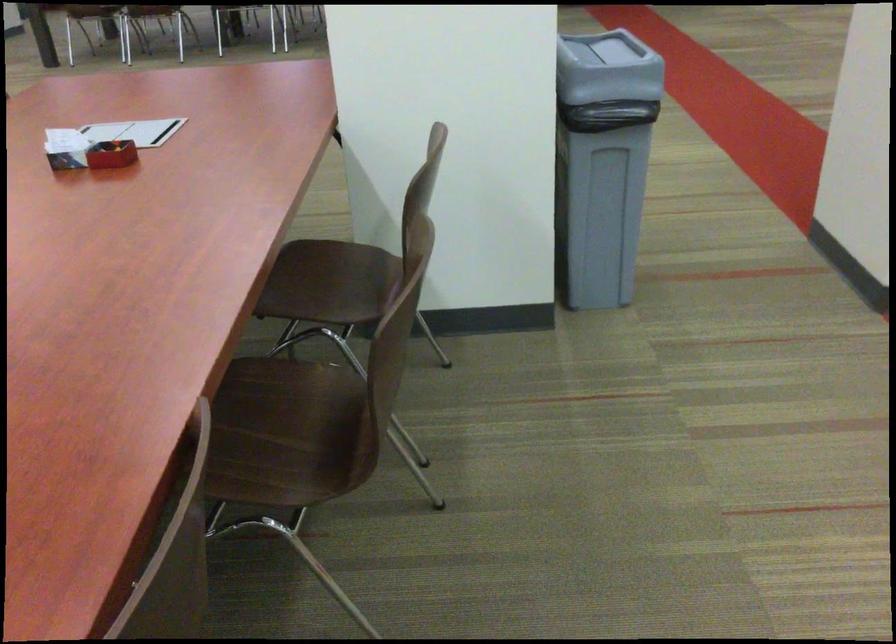
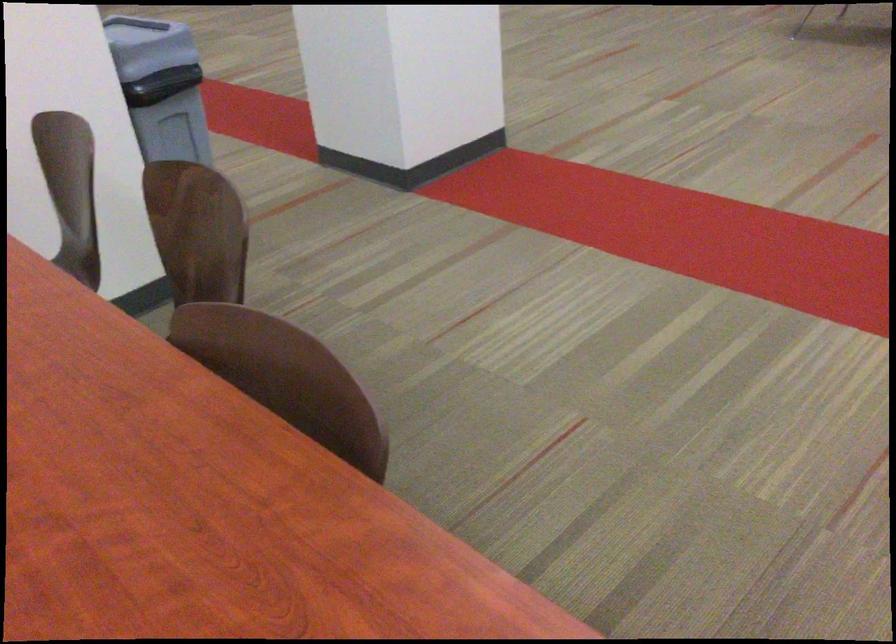
Question: How did the camera likely rotate?

Choices:
 (A) Left
 (B) Right
 (C) Up
 (D) Down

Answer: (B)